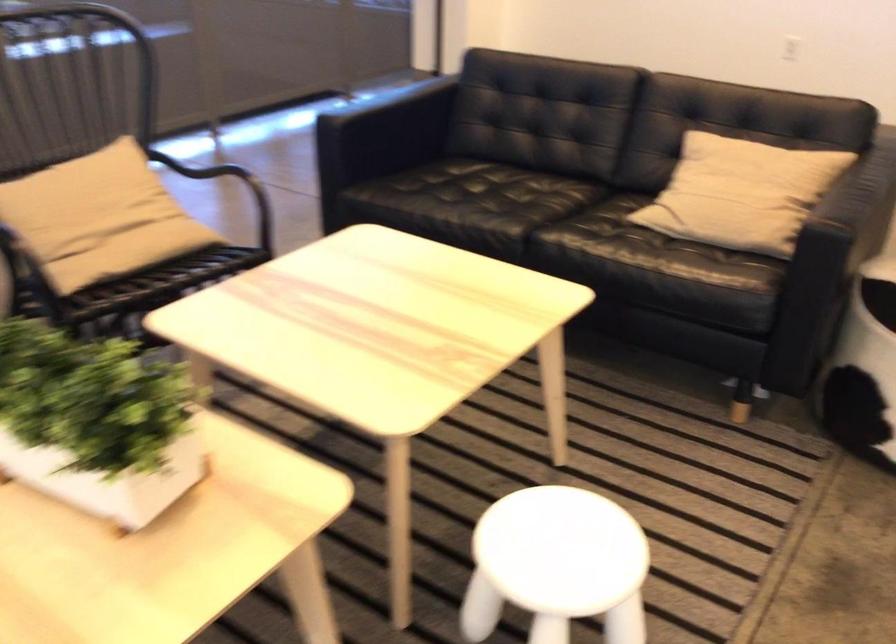
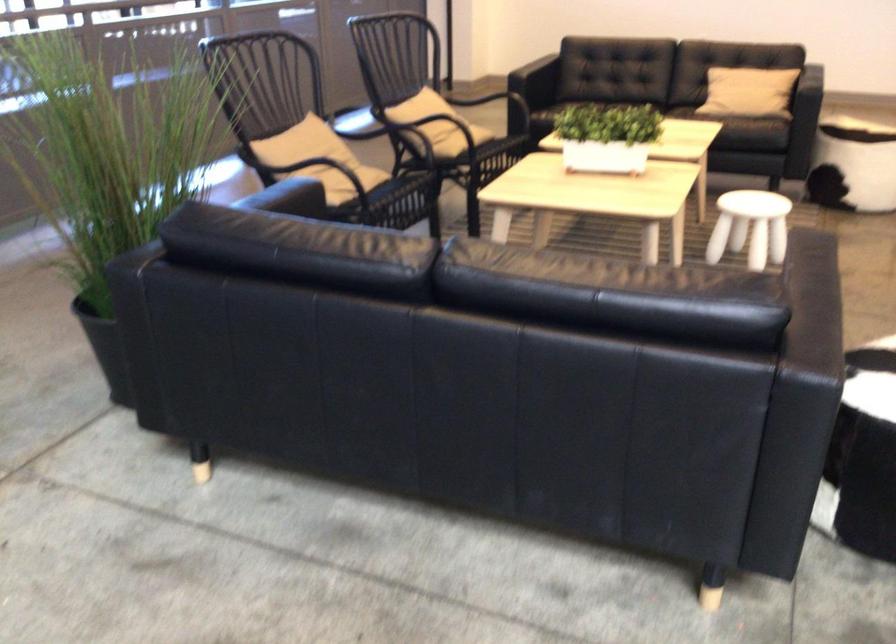
Question: I am providing you with two images of the same scene from different viewpoints. After the viewpoint changes to image2, which objects are now occluded?

Choices:
 (A) chair armrest
 (B) office chair armrest
 (C) black sofa sitting surface
 (D) beige throw pillow

Answer: (A)